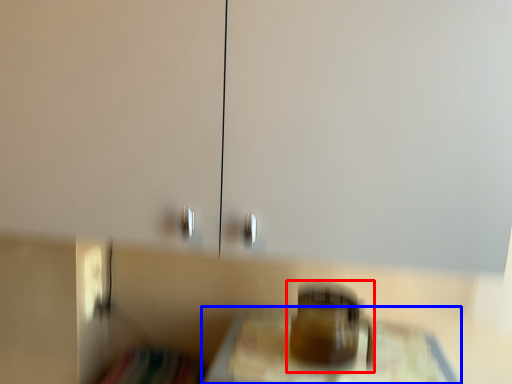
Question: Which object is closer to the camera taking this photo, appliance (highlighted by a red box) or furniture (highlighted by a blue box)?

Choices:
 (A) appliance
 (B) furniture

Answer: (B)